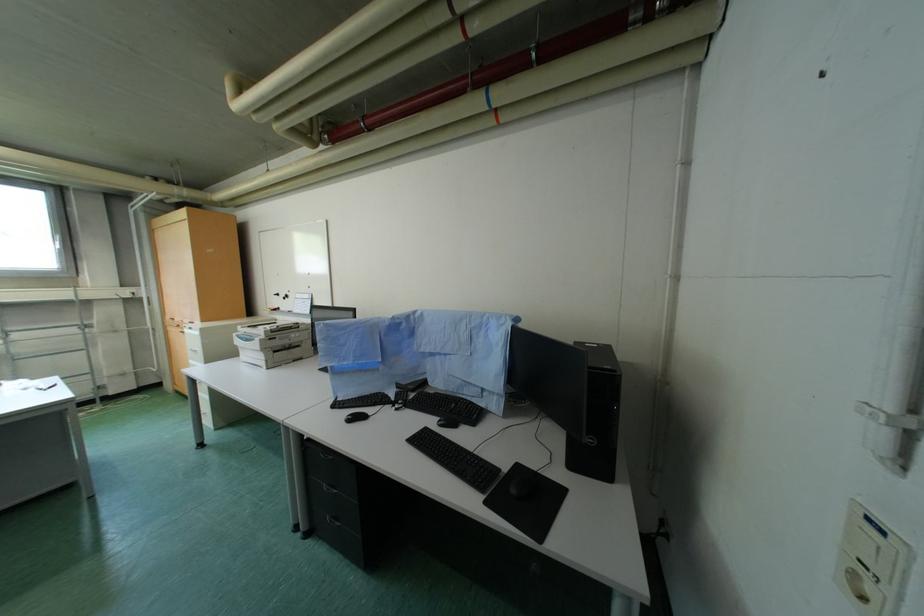
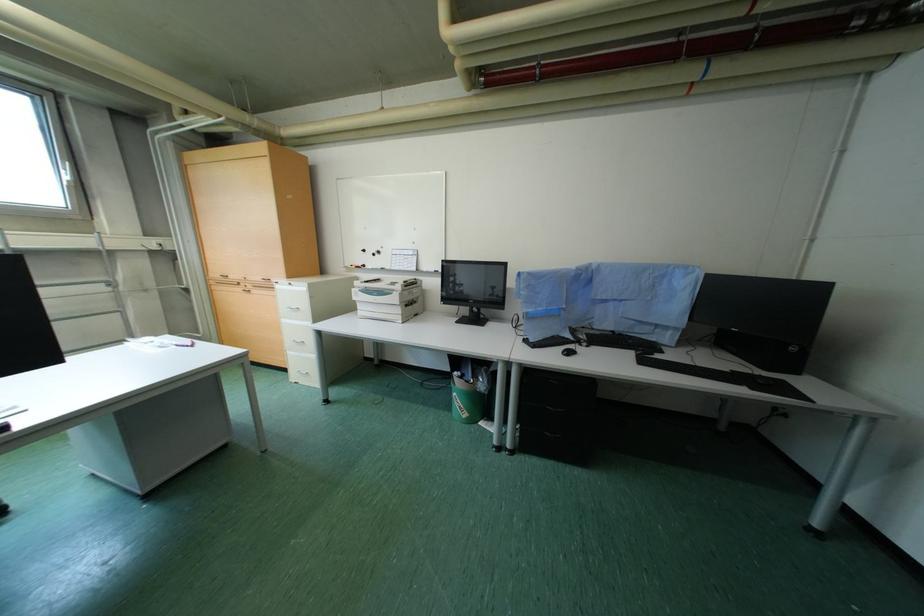
Question: The images are taken continuously from a first-person perspective. In which direction are you moving?

Choices:
 (A) Left
 (B) Right
 (C) Forward
 (D) Backward

Answer: (A)